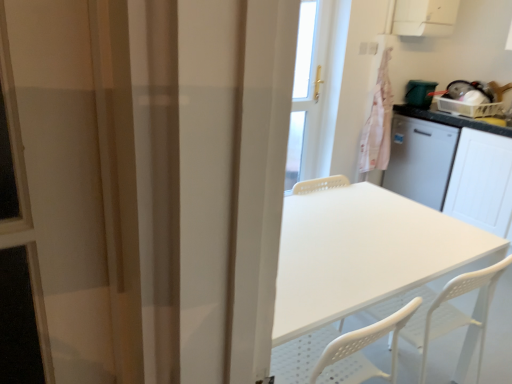
Question: Considering the positions of white plastic table at center and white glossy countertop at right in the image, is white plastic table at center wider or thinner than white glossy countertop at right?

Choices:
 (A) wide
 (B) thin

Answer: (B)

Question: From their relative heights in the image, would you say white plastic table at center is taller or shorter than white glossy countertop at right?

Choices:
 (A) short
 (B) tall

Answer: (A)

Question: Estimate the real-world distances between objects in this image. Which object is closer to the white plastic exhaust hood at upper right?

Choices:
 (A) white matte cabinet at right
 (B) white glossy countertop at right
 (C) pink fabric laundry at upper right
 (D) white plastic table at center
 (E) green plastic bin at right

Answer: (C)

Question: Estimate the real-world distances between objects in this image. Which object is farther from the white matte cabinet at right?

Choices:
 (A) white plastic table at center
 (B) pink fabric laundry at upper right
 (C) white plastic exhaust hood at upper right
 (D) green plastic bin at right
 (E) white glossy countertop at right

Answer: (A)